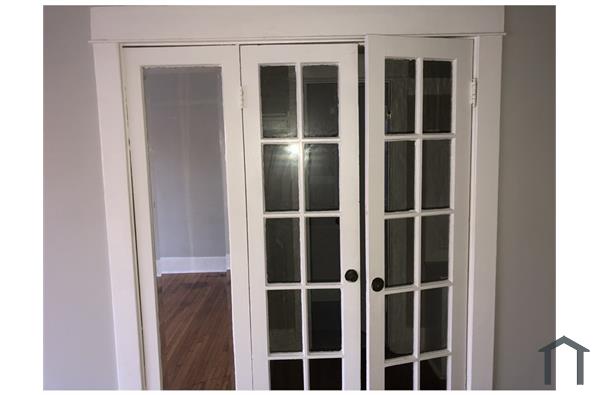
Where is `hinge`? hinge is located at coordinates click(x=244, y=101).